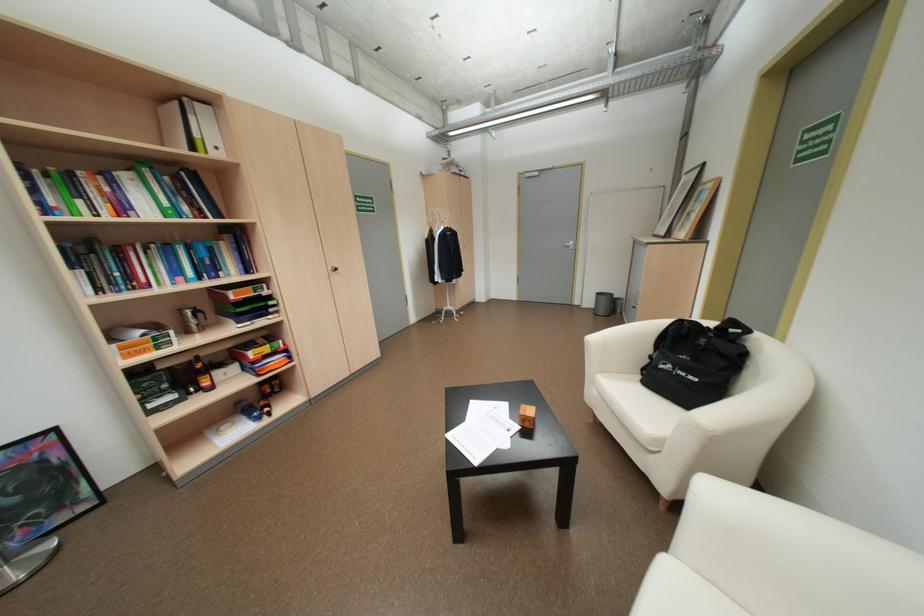
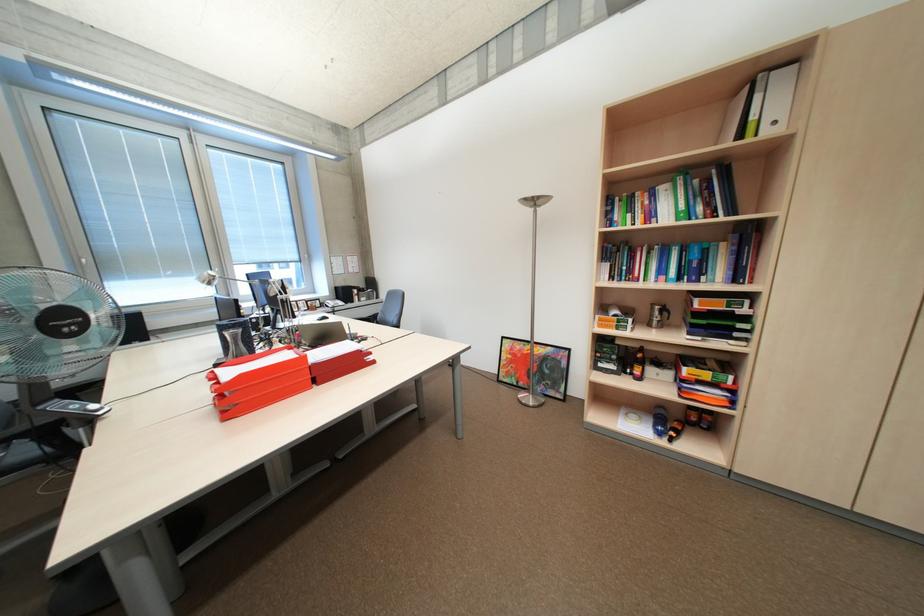
Where in the second image is the point corresponding to pixel 132 207 from the first image?

(661, 215)